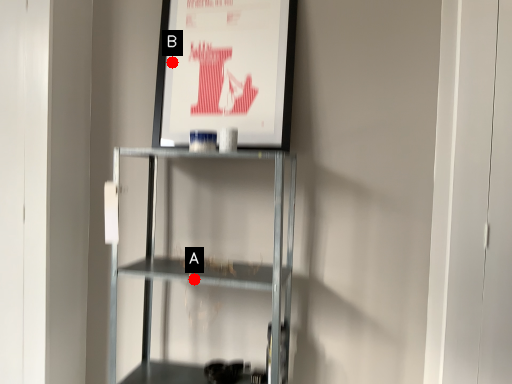
Question: Two points are circled on the image, labeled by A and B beside each circle. Which point appears farthest from the camera in this image?

Choices:
 (A) A is further
 (B) B is further

Answer: (B)